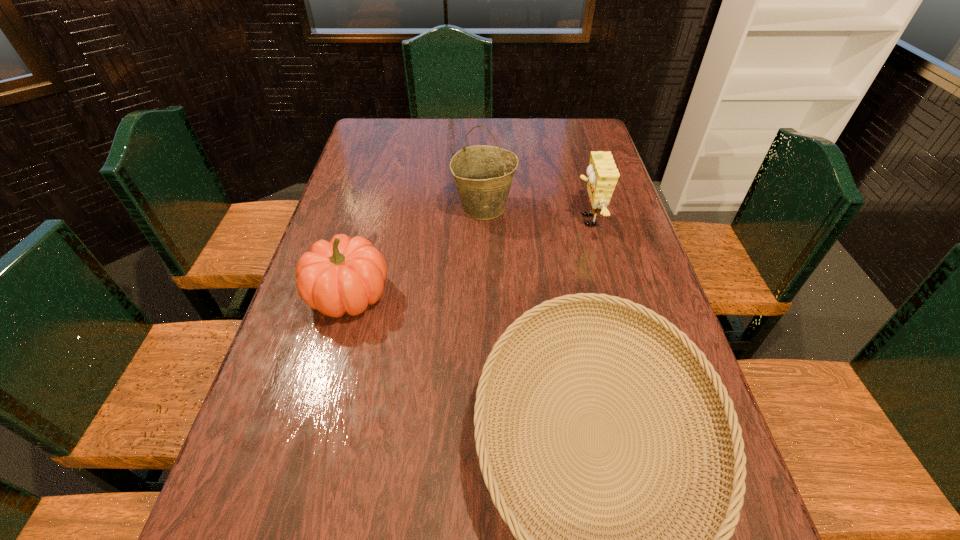
This screenshot has height=540, width=960. In order to click on wine bucket in this screenshot , I will do `click(483, 174)`.

Find the location of a particular element. The height and width of the screenshot is (540, 960). sponge is located at coordinates (603, 175).

At what (x,y) coordinates should I click in order to perform the action: click on pumpkin. Please return your answer as a coordinate pair (x, y). Image resolution: width=960 pixels, height=540 pixels. Looking at the image, I should click on (345, 275).

Identify the location of free location located on the right of the wine bucket. (615, 207).

Identify the location of free space located 0.180m on the front-facing side of the sponge. point(513,220).

Locate an element on the screen. vacant area situated on the front-facing side of the sponge is located at coordinates pyautogui.click(x=532, y=220).

The width and height of the screenshot is (960, 540). What are the coordinates of `vacant space located on the front-facing side of the sponge` in the screenshot? It's located at (545, 220).

This screenshot has width=960, height=540. I want to click on vacant space located 0.350m on the right of the leftmost object, so click(527, 295).

The image size is (960, 540). I want to click on object that is at the left edge, so click(x=345, y=275).

Identify the location of object that is at the right edge. (603, 175).